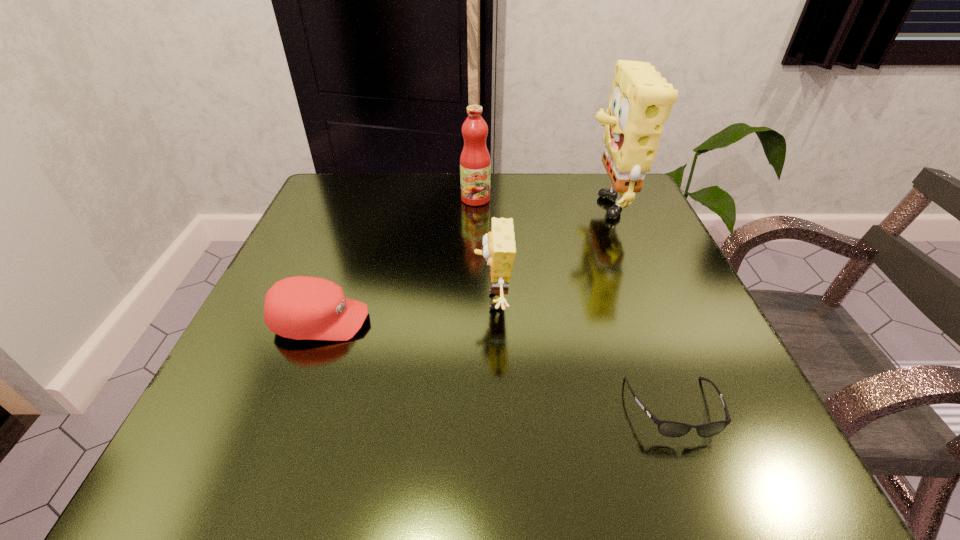
Where is `vacant space located on the face of the right sponge`? This screenshot has height=540, width=960. vacant space located on the face of the right sponge is located at coordinates (523, 201).

Identify the location of vacant area located 0.100m on the face of the right sponge. [536, 201].

Where is `vacant space situated on the front label of the fourth shortest object`? This screenshot has height=540, width=960. vacant space situated on the front label of the fourth shortest object is located at coordinates (474, 293).

Find the location of a particular element. This screenshot has height=540, width=960. free location located 0.080m on the face of the nearer sponge is located at coordinates (429, 301).

This screenshot has height=540, width=960. Find the location of `vacant space located 0.100m on the face of the nearer sponge`. vacant space located 0.100m on the face of the nearer sponge is located at coordinates (418, 301).

You are a GUI agent. You are given a task and a screenshot of the screen. Output one action in this format:
    pyautogui.click(x=<x>, y=<y>)
    Task: Click on the vacant region located on the face of the nearer sponge
    
    Given the screenshot: What is the action you would take?
    pyautogui.click(x=401, y=301)

At what (x,y) coordinates should I click in order to perform the action: click on free space located on the front-facing side of the fourth tallest object. Please return your answer as a coordinate pair (x, y). The image size is (960, 540). Looking at the image, I should click on (608, 321).

You are a GUI agent. You are given a task and a screenshot of the screen. Output one action in this format:
    pyautogui.click(x=<x>, y=<y>)
    Task: Click on the sponge positioned at the far edge
    The height and width of the screenshot is (540, 960).
    Given the screenshot: What is the action you would take?
    pyautogui.click(x=641, y=101)

In order to click on fruit juice present at the far edge in this screenshot , I will do `click(475, 165)`.

You are a GUI agent. You are given a task and a screenshot of the screen. Output one action in this format:
    pyautogui.click(x=<x>, y=<y>)
    Task: Click on the object that is at the near edge
    This screenshot has height=540, width=960.
    Given the screenshot: What is the action you would take?
    pyautogui.click(x=666, y=428)